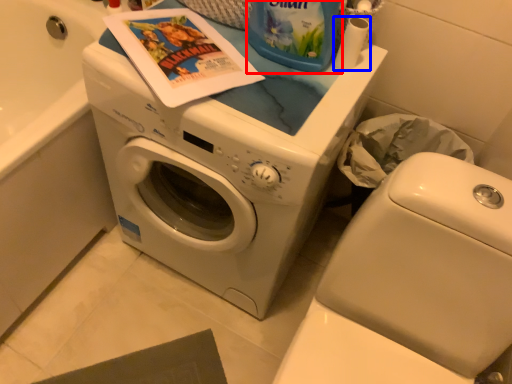
Question: Among these objects, which one is nearest to the camera, cleaning product (highlighted by a red box) or toilet paper (highlighted by a blue box)?

Choices:
 (A) cleaning product
 (B) toilet paper

Answer: (A)